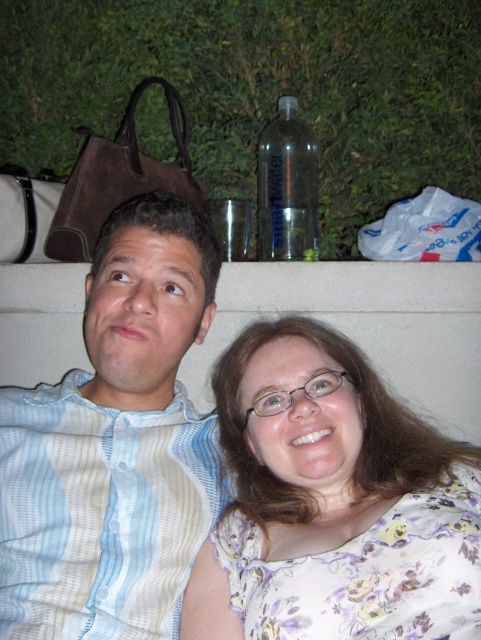
Question: Which point is closer to the camera taking this photo?

Choices:
 (A) (288, 112)
 (B) (157, 333)
 (C) (253, 355)

Answer: (B)

Question: Estimate the real-world distances between objects in this image. Which object is farther from the floral fabric blouse at lower right?

Choices:
 (A) transparent plastic bottle at center
 (B) white striped shirt at upper left

Answer: (A)

Question: Does white striped shirt at upper left have a lesser width compared to transparent plastic bottle at center?

Choices:
 (A) no
 (B) yes

Answer: (A)

Question: Is the position of light blue striped shirt at left less distant than that of transparent plastic bottle at center?

Choices:
 (A) no
 (B) yes

Answer: (B)

Question: Is floral fabric blouse at lower right to the right of white striped shirt at upper left from the viewer's perspective?

Choices:
 (A) yes
 (B) no

Answer: (A)

Question: Which of the following is the farthest from the observer?

Choices:
 (A) (146, 237)
 (B) (392, 547)

Answer: (A)